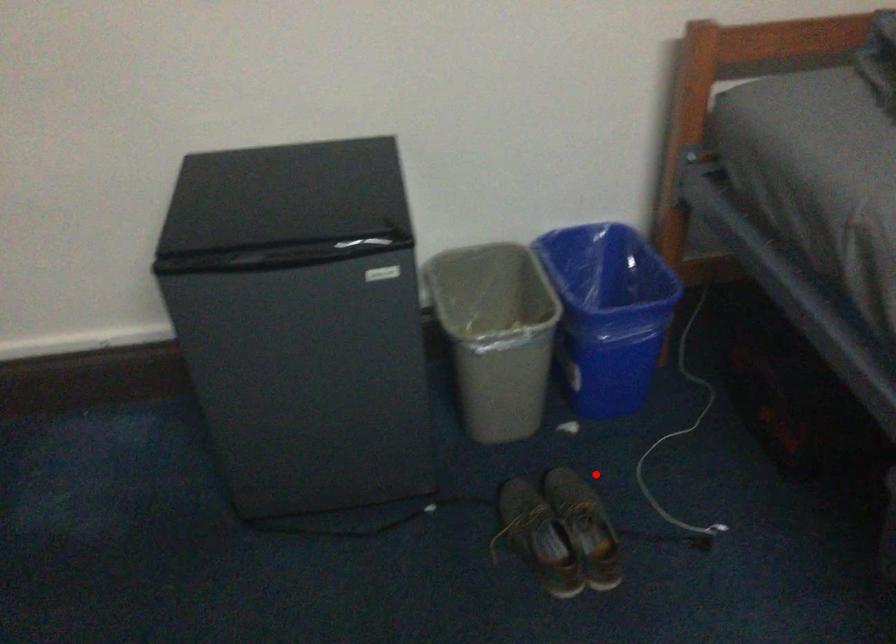
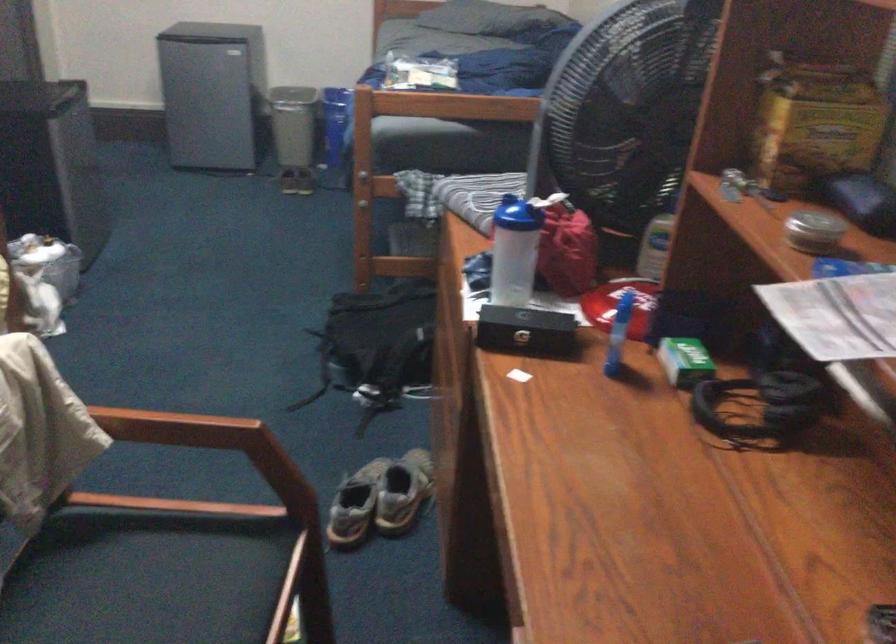
Find the pixel in the second image that matches the highlighted location in the first image.

(293, 124)